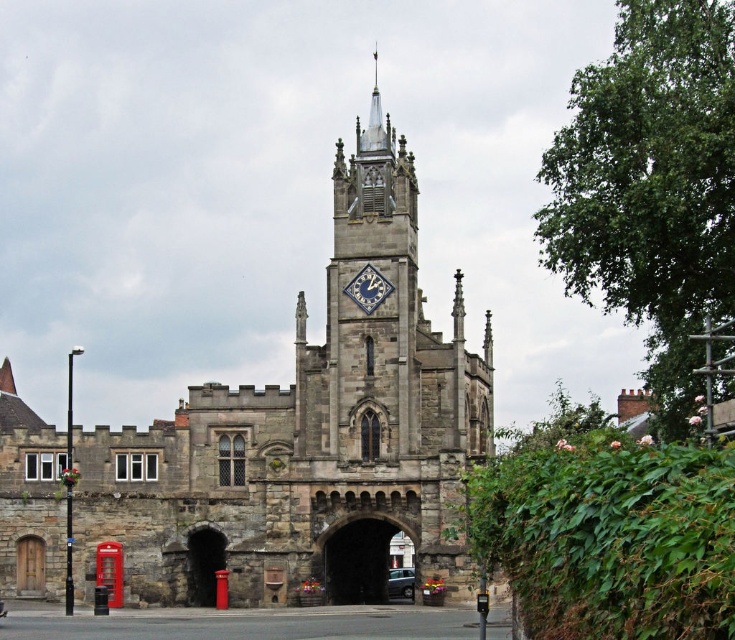
Between stone church at center and metallic gray car at center, which one appears on the right side from the viewer's perspective?

Positioned to the right is metallic gray car at center.

Who is taller, stone church at center or metallic gray car at center?

stone church at center

Is point (101, 480) positioned before point (387, 582)?

No, (101, 480) is behind (387, 582).

Image resolution: width=735 pixels, height=640 pixels. Identify the location of stone church at center. (276, 442).